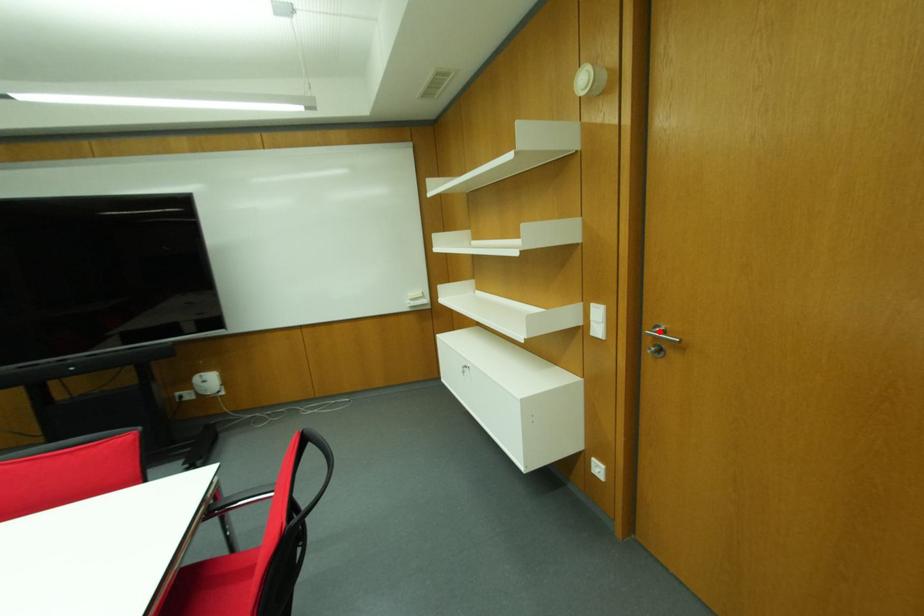
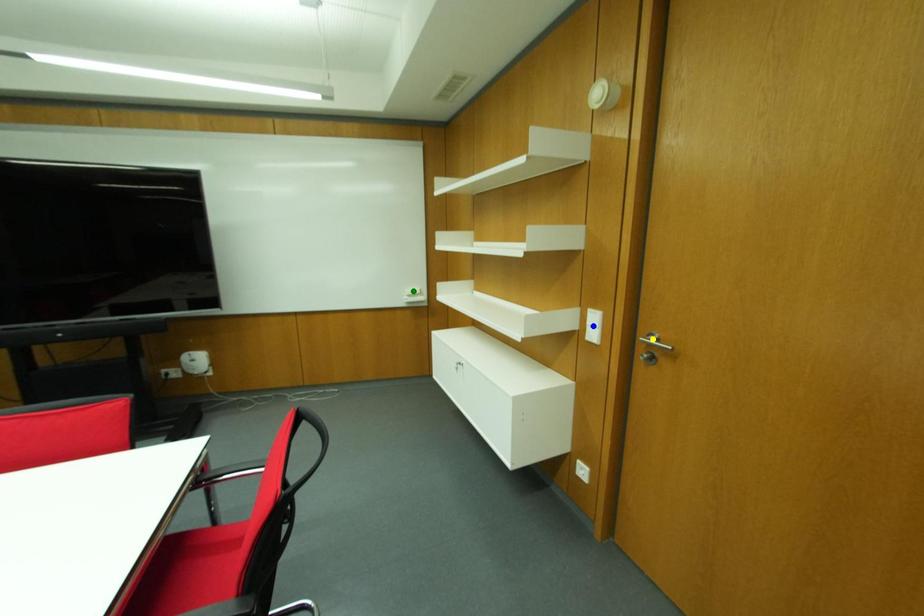
Question: I am providing you with two images of the same scene from different viewpoints. A red point is marked on the first image. You are given multiple points on the second image. In image 2, which mark is for the same physical point as the one in image 1?

Choices:
 (A) yellow point
 (B) blue point
 (C) green point

Answer: (A)